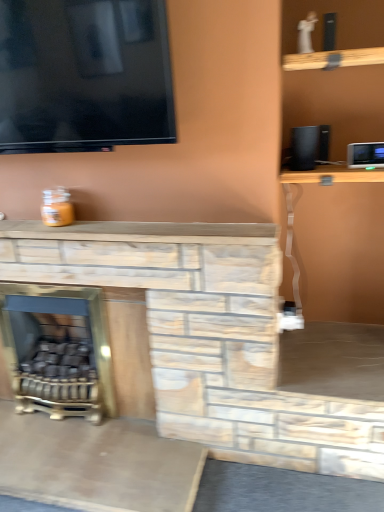
Locate an element on the screen. This screenshot has width=384, height=512. white plastic appliance at upper right is located at coordinates (365, 155).

This screenshot has width=384, height=512. What do you see at coordinates (308, 147) in the screenshot?
I see `black matte speaker at upper right` at bounding box center [308, 147].

Identify the location of black matte speaker at upper right. This screenshot has width=384, height=512. (308, 147).

What do you see at coordinates (58, 350) in the screenshot? I see `gold metallic fireplace at lower left` at bounding box center [58, 350].

This screenshot has height=512, width=384. I want to click on white plastic appliance at upper right, so click(x=365, y=155).

How different are the orientations of black matte speaker at upper right and gold metallic fireplace at lower left in degrees?

They differ by 3.44 degrees in their facing directions.

Considering the relative sizes of black matte speaker at upper right and gold metallic fireplace at lower left in the image provided, is black matte speaker at upper right shorter than gold metallic fireplace at lower left?

Indeed, black matte speaker at upper right has a lesser height compared to gold metallic fireplace at lower left.

Considering the relative sizes of black matte speaker at upper right and gold metallic fireplace at lower left in the image provided, is black matte speaker at upper right smaller than gold metallic fireplace at lower left?

Indeed, black matte speaker at upper right has a smaller size compared to gold metallic fireplace at lower left.

Measure the distance from white plastic appliance at upper right to gold metallic fireplace at lower left.

white plastic appliance at upper right is 4.34 feet from gold metallic fireplace at lower left.

Is white plastic appliance at upper right not close to gold metallic fireplace at lower left?

white plastic appliance at upper right is far away from gold metallic fireplace at lower left.

Does white plastic appliance at upper right have a lesser height compared to gold metallic fireplace at lower left?

Yes, white plastic appliance at upper right is shorter than gold metallic fireplace at lower left.

Could you tell me if white plastic appliance at upper right is turned towards gold metallic fireplace at lower left?

No.

Does black matte speaker at upper right lie behind white plastic appliance at upper right?

Yes, black matte speaker at upper right is further from the viewer.

Who is shorter, black matte speaker at upper right or white plastic appliance at upper right?

Standing shorter between the two is white plastic appliance at upper right.

Based on the photo, from the image's perspective, is black matte speaker at upper right positioned above or below white plastic appliance at upper right?

Clearly, from the image's perspective, black matte speaker at upper right is above white plastic appliance at upper right.

Is the surface of black matte speaker at upper right in direct contact with white plastic appliance at upper right?

No.

From a real-world perspective, which object rests below the other?

In real-world perspective, white plastic appliance at upper right is lower.

Would you say white plastic appliance at upper right is outside black matte speaker at upper right?

Indeed, white plastic appliance at upper right is completely outside black matte speaker at upper right.

Does white plastic appliance at upper right lie behind black matte speaker at upper right?

No, white plastic appliance at upper right is closer to the viewer.

Is point (357, 144) positioned in front of point (318, 134)?

Yes, point (357, 144) is closer to viewer.

Considering the sizes of objects gold metallic fireplace at lower left and white plastic appliance at upper right in the image provided, who is shorter, gold metallic fireplace at lower left or white plastic appliance at upper right?

Standing shorter between the two is white plastic appliance at upper right.

Consider the image. From a real-world perspective, who is located lower, gold metallic fireplace at lower left or white plastic appliance at upper right?

gold metallic fireplace at lower left is physically lower.

Consider the image. From the image's perspective, which is below, gold metallic fireplace at lower left or white plastic appliance at upper right?

gold metallic fireplace at lower left, from the image's perspective.

Which of these two, gold metallic fireplace at lower left or black matte speaker at upper right, is wider?

With larger width is gold metallic fireplace at lower left.

From the image's perspective, is gold metallic fireplace at lower left below black matte speaker at upper right?

Correct, gold metallic fireplace at lower left appears lower than black matte speaker at upper right in the image.

Would you say gold metallic fireplace at lower left contains black matte speaker at upper right?

No, black matte speaker at upper right is not a part of gold metallic fireplace at lower left.

Is point (32, 362) positioned behind point (308, 158)?

Yes, point (32, 362) is farther from viewer.

The image size is (384, 512). In order to click on speaker above the gold metallic fireplace at lower left (from a real-world perspective) in this screenshot , I will do coord(308,147).

You are a GUI agent. You are given a task and a screenshot of the screen. Output one action in this format:
    pyautogui.click(x=<x>, y=<y>)
    Task: Click on the fireplace to the left of white plastic appliance at upper right
    
    Given the screenshot: What is the action you would take?
    pyautogui.click(x=58, y=350)

Looking at the image, which one is located closer to white plastic appliance at upper right, gold metallic fireplace at lower left or black matte speaker at upper right?

Based on the image, black matte speaker at upper right appears to be nearer to white plastic appliance at upper right.

Looking at the image, which one is located closer to gold metallic fireplace at lower left, black matte speaker at upper right or white plastic appliance at upper right?

The object closer to gold metallic fireplace at lower left is black matte speaker at upper right.

Estimate the real-world distances between objects in this image. Which object is closer to gold metallic fireplace at lower left, white plastic appliance at upper right or black matte speaker at upper right?

black matte speaker at upper right.

Based on the photo, which object lies nearer to the anchor point black matte speaker at upper right, white plastic appliance at upper right or gold metallic fireplace at lower left?

white plastic appliance at upper right.

From the image, which object appears to be farther from white plastic appliance at upper right, black matte speaker at upper right or gold metallic fireplace at lower left?

gold metallic fireplace at lower left is further to white plastic appliance at upper right.

Estimate the real-world distances between objects in this image. Which object is further from black matte speaker at upper right, gold metallic fireplace at lower left or white plastic appliance at upper right?

Among the two, gold metallic fireplace at lower left is located further to black matte speaker at upper right.

The width and height of the screenshot is (384, 512). I want to click on speaker between gold metallic fireplace at lower left and white plastic appliance at upper right in the horizontal direction, so click(308, 147).